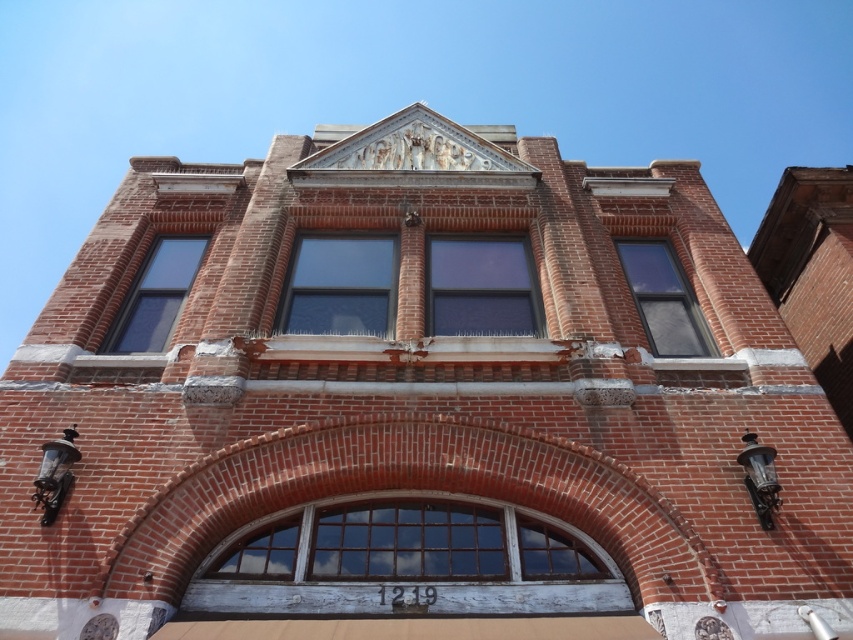
You are an architect inspecting the building facade. You notice two windows at the center of the building. One is labeled as the clear glass window at center and the other as the transparent glass window at center. Which of these two windows has a smaller width?

The clear glass window at center has a smaller width than the transparent glass window at center according to the description.

You are an architect inspecting the building facade. You need to determine which window has a greater width between the clear glass window at right and the matte glass window at upper left based on the scene description. Which one is wider?

The clear glass window at right is wider than the matte glass window at upper left because the description states that its width surpasses the matte glass window at upper left.

You are standing in front of the two story brick building. You see two points marked on the facade. The first is at point [662,320] and the second is at point [167,291]. Which point is closer to you?

Point [662,320] is in front of point [167,291], so the first point is closer to you.